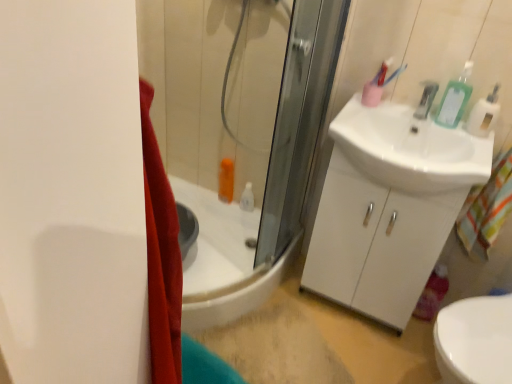
Image resolution: width=512 pixels, height=384 pixels. I want to click on green plastic bottle at upper right, so click(455, 99).

Identify the location of white plastic soap dispenser at upper right. This screenshot has width=512, height=384. (484, 114).

How different are the orientations of white glossy cabinet at right and metallic silver faucet at upper right in degrees?

They differ by 0.572 degrees in their facing directions.

Is white glossy cabinet at right shorter than metallic silver faucet at upper right?

No.

Where is `bathroom cabinet beneath the metallic silver faucet at upper right (from a real-world perspective)`? This screenshot has width=512, height=384. bathroom cabinet beneath the metallic silver faucet at upper right (from a real-world perspective) is located at coordinates (376, 242).

Based on the photo, is white glossy cabinet at right far from metallic silver faucet at upper right?

No.

Considering the relative positions of white glossy cabinet at right and white glossy sink at right in the image provided, is white glossy cabinet at right to the left of white glossy sink at right from the viewer's perspective?

Indeed, white glossy cabinet at right is positioned on the left side of white glossy sink at right.

Do you think white glossy cabinet at right is within white glossy sink at right, or outside of it?

The correct answer is: outside.

Which of these two, white glossy cabinet at right or white glossy sink at right, is thinner?

white glossy cabinet at right is thinner.

From the image's perspective, between white plastic soap dispenser at upper right and metallic silver faucet at upper right, which one is located above?

metallic silver faucet at upper right.

Can you confirm if white plastic soap dispenser at upper right is bigger than metallic silver faucet at upper right?

Correct, white plastic soap dispenser at upper right is larger in size than metallic silver faucet at upper right.

Is point (484, 127) closer to viewer compared to point (431, 91)?

Yes, it is in front of point (431, 91).

Can you tell me how much white plastic soap dispenser at upper right and metallic silver faucet at upper right differ in facing direction?

white plastic soap dispenser at upper right and metallic silver faucet at upper right are facing 0.000668 degrees away from each other.

How far apart are white glossy sink at right and green plastic bottle at upper right?

white glossy sink at right and green plastic bottle at upper right are 8.53 inches apart.

Is white glossy sink at right touching green plastic bottle at upper right?

No, white glossy sink at right is not next to green plastic bottle at upper right.

Where is `toiletry on the right of white glossy sink at right`? The height and width of the screenshot is (384, 512). toiletry on the right of white glossy sink at right is located at coordinates (455, 99).

From the image's perspective, between white glossy sink at right and green plastic bottle at upper right, who is located below?

A: white glossy sink at right is shown below in the image.

Do you think white glossy sink at right is within white glossy cabinet at right, or outside of it?

white glossy sink at right is inside white glossy cabinet at right.

Considering the relative sizes of white glossy sink at right and white glossy cabinet at right in the image provided, is white glossy sink at right bigger than white glossy cabinet at right?

Actually, white glossy sink at right might be smaller than white glossy cabinet at right.

Considering the points (451, 172) and (439, 247), which point is in front, point (451, 172) or point (439, 247)?

The point (451, 172) is closer.

At what (x,y) coordinates should I click in order to perform the action: click on bathroom cabinet located behind the white glossy sink at right. Please return your answer as a coordinate pair (x, y). The width and height of the screenshot is (512, 384). Looking at the image, I should click on (376, 242).

From a real-world perspective, which object rests below the other?

In real-world perspective, white glossy sink at right is lower.

Does point (393, 167) appear closer or farther from the camera than point (489, 99)?

Clearly, point (393, 167) is closer to the camera than point (489, 99).

From the picture: Is white glossy sink at right outside of white plastic soap dispenser at upper right?

Yes, white glossy sink at right is located beyond the bounds of white plastic soap dispenser at upper right.

From the image's perspective, does white glossy sink at right appear lower than white plastic soap dispenser at upper right?

Indeed, from the image's perspective, white glossy sink at right is shown beneath white plastic soap dispenser at upper right.

Is metallic silver faucet at upper right surrounded by green plastic bottle at upper right?

No, metallic silver faucet at upper right is not surrounded by green plastic bottle at upper right.

Is green plastic bottle at upper right next to metallic silver faucet at upper right and touching it?

Yes, the surface of green plastic bottle at upper right is in contact with metallic silver faucet at upper right.

How different are the orientations of green plastic bottle at upper right and metallic silver faucet at upper right in degrees?

0.000407 degrees separate the facing orientations of green plastic bottle at upper right and metallic silver faucet at upper right.

Could you tell me if green plastic bottle at upper right is turned towards metallic silver faucet at upper right?

No, green plastic bottle at upper right is not aimed at metallic silver faucet at upper right.

Image resolution: width=512 pixels, height=384 pixels. What are the coordinates of `faucet located behind the white glossy cabinet at right` in the screenshot? It's located at (426, 99).

The width and height of the screenshot is (512, 384). In the image, there is a white glossy sink at right. Identify the location of bathroom cabinet below it (from the image's perspective). (376, 242).

Considering their positions, is metallic silver faucet at upper right positioned closer to white glossy cabinet at right than green plastic bottle at upper right?

Based on the image, green plastic bottle at upper right appears to be nearer to white glossy cabinet at right.

Based on the photo, looking at the image, which one is located further to metallic silver faucet at upper right, white glossy sink at right or green plastic bottle at upper right?

Among the two, white glossy sink at right is located further to metallic silver faucet at upper right.

Considering their positions, is green plastic bottle at upper right positioned further to white glossy cabinet at right than metallic silver faucet at upper right?

metallic silver faucet at upper right is further to white glossy cabinet at right.

Estimate the real-world distances between objects in this image. Which object is closer to metallic silver faucet at upper right, white plastic soap dispenser at upper right or green plastic bottle at upper right?

green plastic bottle at upper right lies closer to metallic silver faucet at upper right than the other object.

Estimate the real-world distances between objects in this image. Which object is further from white plastic soap dispenser at upper right, green plastic bottle at upper right or white glossy cabinet at right?

white glossy cabinet at right.

From the image, which object appears to be nearer to white glossy cabinet at right, metallic silver faucet at upper right or white glossy sink at right?

white glossy sink at right lies closer to white glossy cabinet at right than the other object.

Which object lies nearer to the anchor point white glossy cabinet at right, green plastic bottle at upper right or white glossy sink at right?

Among the two, white glossy sink at right is located nearer to white glossy cabinet at right.

From the image, which object appears to be nearer to white plastic soap dispenser at upper right, white glossy sink at right or green plastic bottle at upper right?

green plastic bottle at upper right is positioned closer to the anchor white plastic soap dispenser at upper right.

You are a GUI agent. You are given a task and a screenshot of the screen. Output one action in this format:
    pyautogui.click(x=<x>, y=<y>)
    Task: Click on the soap dispenser between metallic silver faucet at upper right and white glossy cabinet at right in the vertical direction
    
    Given the screenshot: What is the action you would take?
    pyautogui.click(x=484, y=114)

I want to click on faucet between green plastic bottle at upper right and white glossy sink at right in the up-down direction, so click(x=426, y=99).

I want to click on soap dispenser that lies between green plastic bottle at upper right and white glossy cabinet at right from top to bottom, so click(484, 114).

I want to click on toiletry situated between white glossy sink at right and white plastic soap dispenser at upper right from left to right, so click(455, 99).